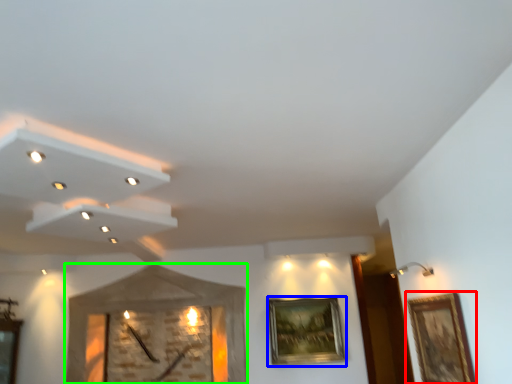
Question: Which object is positioned farthest from picture frame (highlighted by a red box)? Select from picture frame (highlighted by a blue box) and clock (highlighted by a green box).

Choices:
 (A) picture frame
 (B) clock

Answer: (B)